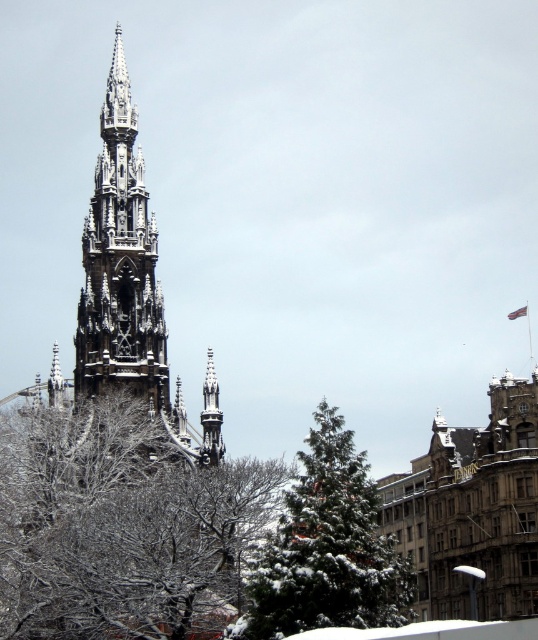
Question: From the image, what is the correct spatial relationship of green textured tree at center in relation to dark gray stone spire at center?

Choices:
 (A) left
 (B) right

Answer: (B)

Question: Which point appears farthest from the camera in this image?

Choices:
 (A) (360, 490)
 (B) (54, 467)
 (C) (109, 284)

Answer: (C)

Question: Estimate the real-world distances between objects in this image. Which object is farther from the snow-covered branches at center?

Choices:
 (A) green textured tree at center
 (B) dark gray stone spire at center

Answer: (B)

Question: Does snow-covered branches at center appear on the left side of dark gray stone spire at center?

Choices:
 (A) yes
 (B) no

Answer: (B)

Question: Can you confirm if snow-covered branches at center is positioned to the left of green textured tree at center?

Choices:
 (A) no
 (B) yes

Answer: (B)

Question: Which object is positioned closest to the snow-covered branches at center?

Choices:
 (A) dark gray stone spire at center
 (B) green textured tree at center

Answer: (B)